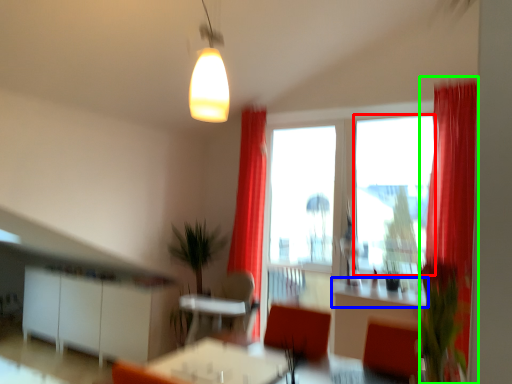
Question: Estimate the real-world distances between objects in this image. Which object is closer to window screen (highlighted by a red box), counter top (highlighted by a blue box) or curtain (highlighted by a green box)?

Choices:
 (A) counter top
 (B) curtain

Answer: (B)